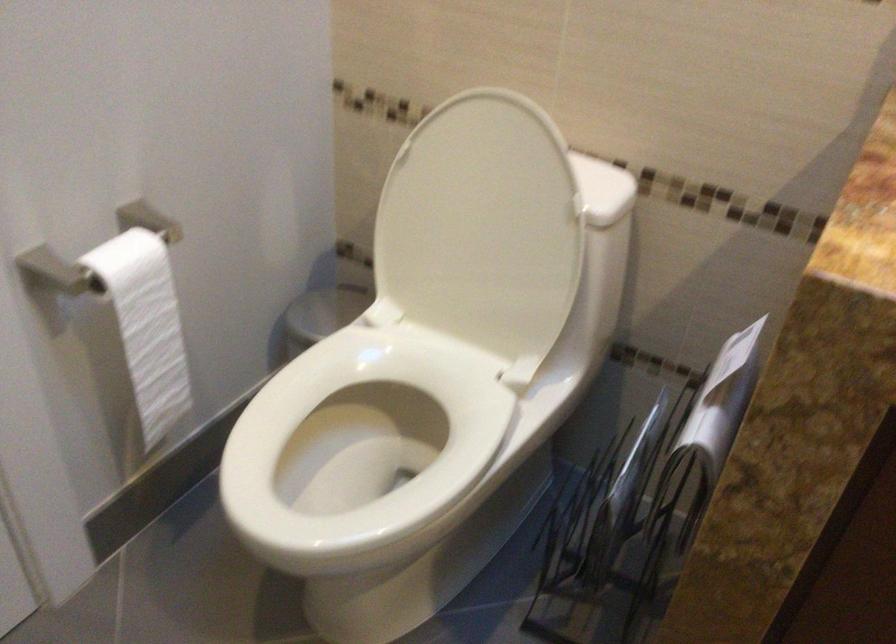
Find the location of a particular element. The image size is (896, 644). white toilet seat is located at coordinates (363, 438).